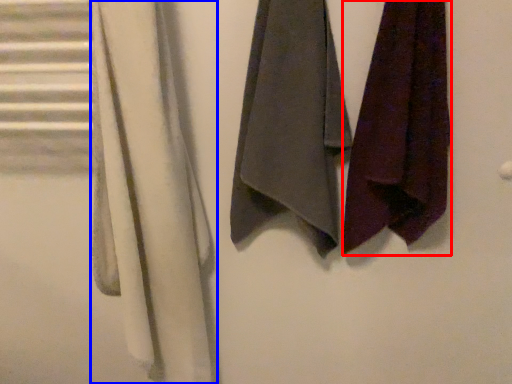
Question: Which object appears farthest to the camera in this image, towel (highlighted by a red box) or cloth (highlighted by a blue box)?

Choices:
 (A) towel
 (B) cloth

Answer: (A)